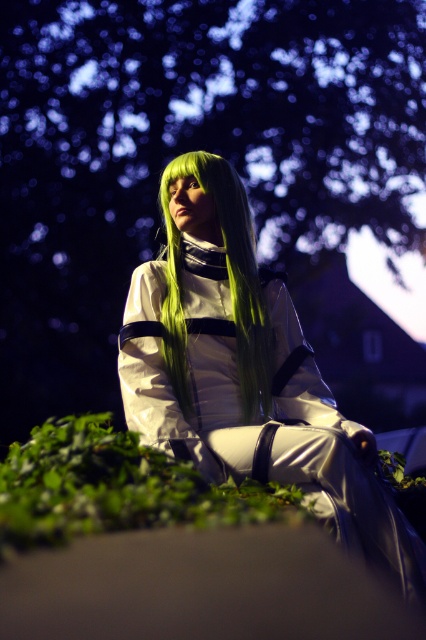
At what (x,y) coordinates should I click in order to perform the action: click on satin green wig at center. Please return your answer as a coordinate pair (x, y). The width and height of the screenshot is (426, 640). Looking at the image, I should click on (247, 372).

Which is more to the left, satin green wig at center or green silky wig at center?

green silky wig at center

Which is in front, point (253, 284) or point (167, 218)?

Positioned in front is point (253, 284).

Locate an element on the screen. satin green wig at center is located at coordinates [247, 372].

Does point (422, 6) come closer to viewer compared to point (195, 358)?

No, it is behind (195, 358).

Who is higher up, green leafy tree at upper center or satin green wig at center?

Result: Positioned higher is green leafy tree at upper center.

Is point (256, 60) farther from viewer compared to point (238, 404)?

Yes, point (256, 60) is farther from viewer.

Where is `green leafy tree at upper center`? The height and width of the screenshot is (640, 426). green leafy tree at upper center is located at coordinates (183, 150).

Based on the photo, which of these two, green leafy tree at upper center or green silky wig at center, stands shorter?

Standing shorter between the two is green silky wig at center.

Consider the image. Does green leafy tree at upper center appear over green silky wig at center?

Correct, green leafy tree at upper center is located above green silky wig at center.

This screenshot has width=426, height=640. What are the coordinates of `green leafy tree at upper center` in the screenshot? It's located at (183, 150).

In order to click on green leafy tree at upper center in this screenshot , I will do `click(183, 150)`.